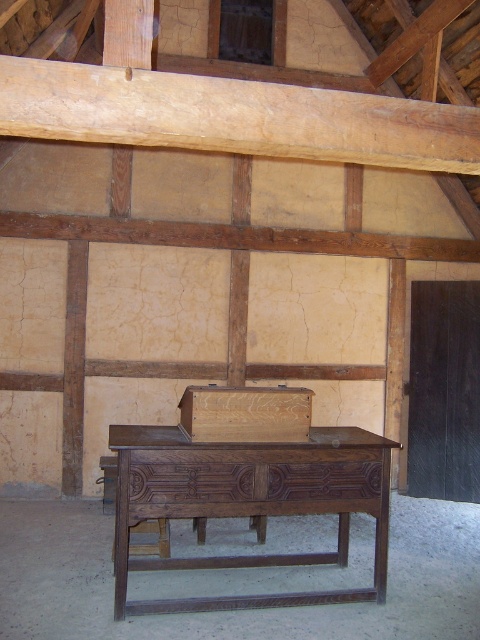
Question: Which of the following is the closest to the observer?

Choices:
 (A) light brown wooden beam at upper center
 (B) dark wood table at center

Answer: (A)

Question: Does light brown wooden beam at upper center have a larger size compared to dark wood table at center?

Choices:
 (A) yes
 (B) no

Answer: (B)

Question: Which object is farther from the camera taking this photo?

Choices:
 (A) light brown wooden beam at upper center
 (B) dark wood table at center

Answer: (B)

Question: Does light brown wooden beam at upper center appear on the right side of dark wood table at center?

Choices:
 (A) no
 (B) yes

Answer: (B)

Question: Does light brown wooden beam at upper center come in front of dark wood table at center?

Choices:
 (A) no
 (B) yes

Answer: (B)